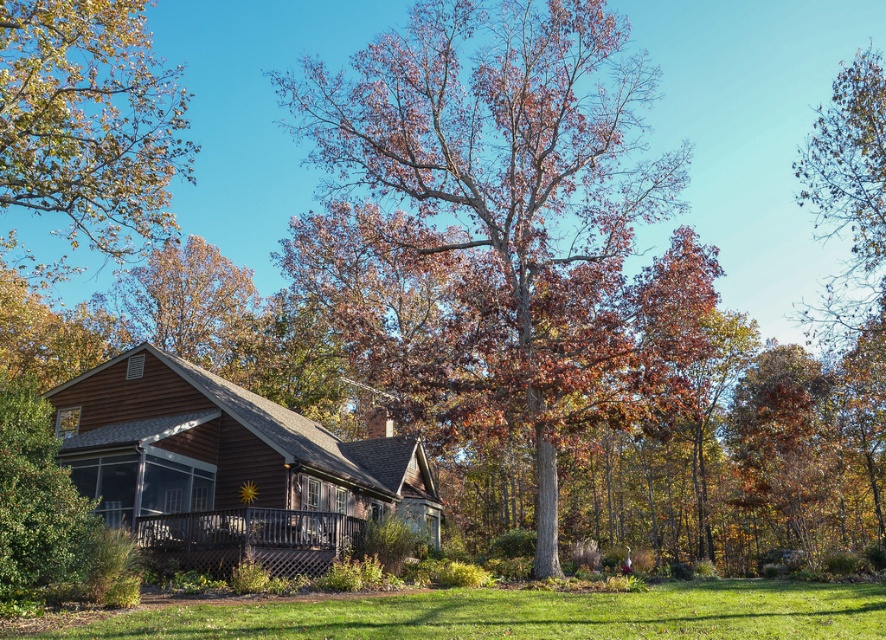
Who is positioned more to the left, green leafy tree at upper left or green grass at lower center?

green leafy tree at upper left is more to the left.

Is green leafy tree at upper left smaller than green grass at lower center?

Incorrect, green leafy tree at upper left is not smaller in size than green grass at lower center.

Is point (27, 26) farther from viewer compared to point (65, 636)?

Yes, point (27, 26) is farther from viewer.

The height and width of the screenshot is (640, 886). Find the location of `green leafy tree at upper left`. green leafy tree at upper left is located at coordinates (89, 120).

Consider the image. Which of these two, brown wood cabin at center or green grass at lower center, stands taller?

Standing taller between the two is brown wood cabin at center.

Can you confirm if brown wood cabin at center is shorter than green grass at lower center?

No.

Does point (114, 356) come in front of point (351, 602)?

No, it is behind (351, 602).

You are a GUI agent. You are given a task and a screenshot of the screen. Output one action in this format:
    pyautogui.click(x=<x>, y=<y>)
    Task: Click on the brown wood cabin at center
    
    Given the screenshot: What is the action you would take?
    pyautogui.click(x=228, y=467)

The width and height of the screenshot is (886, 640). In order to click on brown textured tree at center in this screenshot , I will do `click(510, 188)`.

Can you confirm if brown textured tree at center is positioned above green leafy tree at upper left?

No, brown textured tree at center is not above green leafy tree at upper left.

What do you see at coordinates (510, 188) in the screenshot? The image size is (886, 640). I see `brown textured tree at center` at bounding box center [510, 188].

You are a GUI agent. You are given a task and a screenshot of the screen. Output one action in this format:
    pyautogui.click(x=<x>, y=<y>)
    Task: Click on the brown textured tree at center
    This screenshot has width=886, height=640.
    Given the screenshot: What is the action you would take?
    pyautogui.click(x=510, y=188)